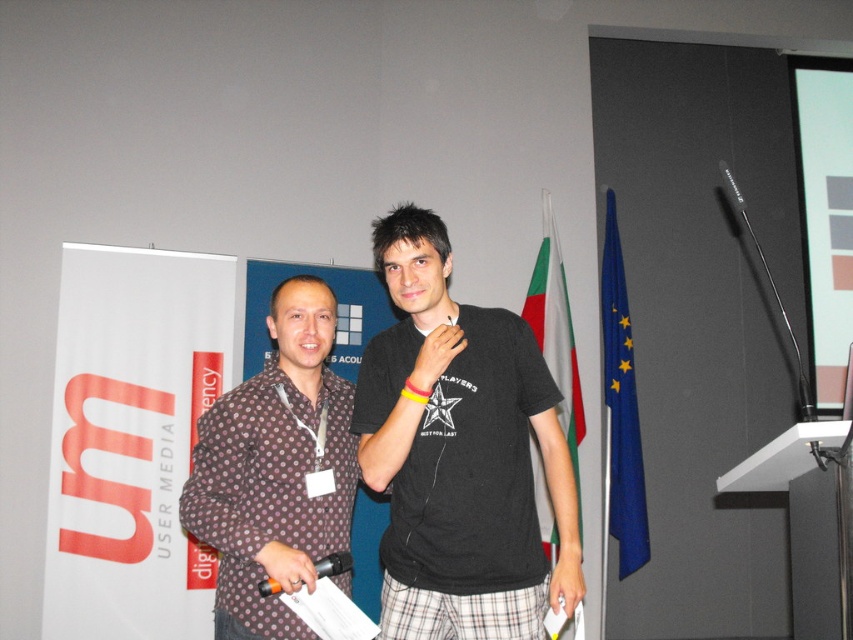
You are standing in the room and want to move from the point at coordinates (445, 502) to the point at coordinates (268, 577). Which direction should you move in to get closer to your destination?

Since point (445, 502) is further to the viewer than point (268, 577), you should move forward to get closer to the destination at (268, 577).